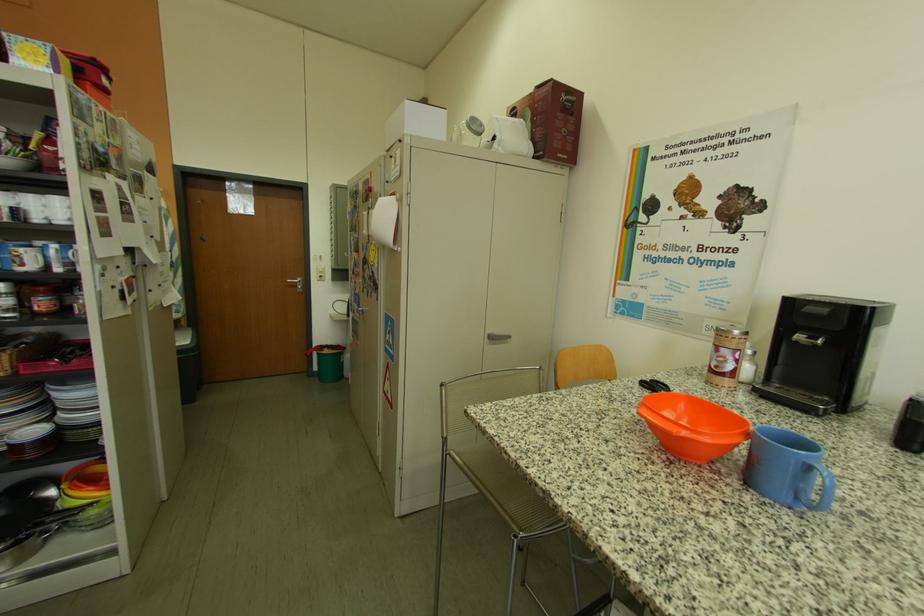
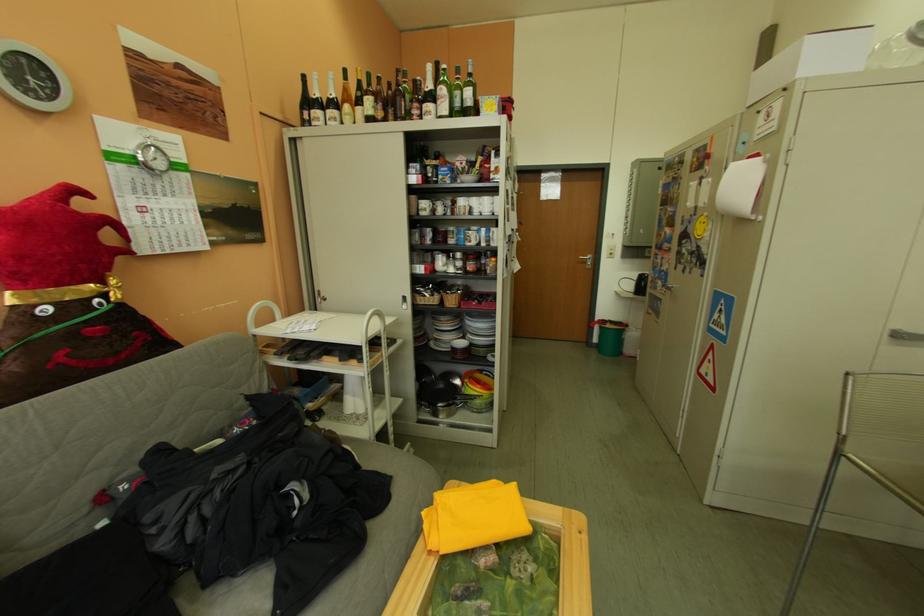
Where in the second image is the point corresponding to [472,137] from the first image?

(904, 55)